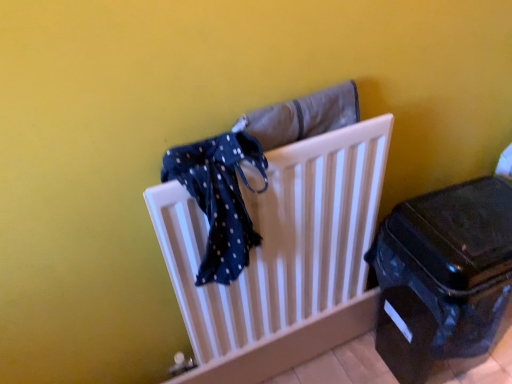
Question: Is shiny black suitcase at lower right wider or thinner than blue dotted fabric at center?

Choices:
 (A) wide
 (B) thin

Answer: (A)

Question: Relative to blue dotted fabric at center, is shiny black suitcase at lower right in front or behind?

Choices:
 (A) front
 (B) behind

Answer: (B)

Question: Based on their relative distances, which object is farther from the white plastic radiator at center?

Choices:
 (A) blue dotted fabric at center
 (B) shiny black suitcase at lower right

Answer: (B)

Question: Based on their relative distances, which object is nearer to the blue dotted fabric at center?

Choices:
 (A) shiny black suitcase at lower right
 (B) white plastic radiator at center

Answer: (B)